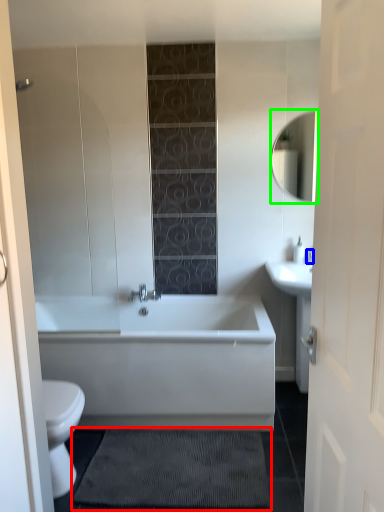
Question: Which object is positioned closest to bath mat (highlighted by a red box)? Select from faucet (highlighted by a blue box) and mirror (highlighted by a green box).

Choices:
 (A) faucet
 (B) mirror

Answer: (A)